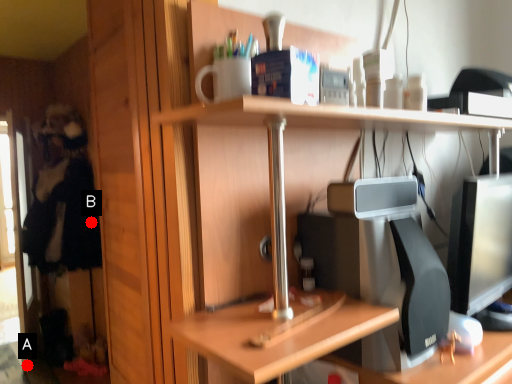
Question: Two points are circled on the image, labeled by A and B beside each circle. Which point is closer to the camera?

Choices:
 (A) A is closer
 (B) B is closer

Answer: (A)